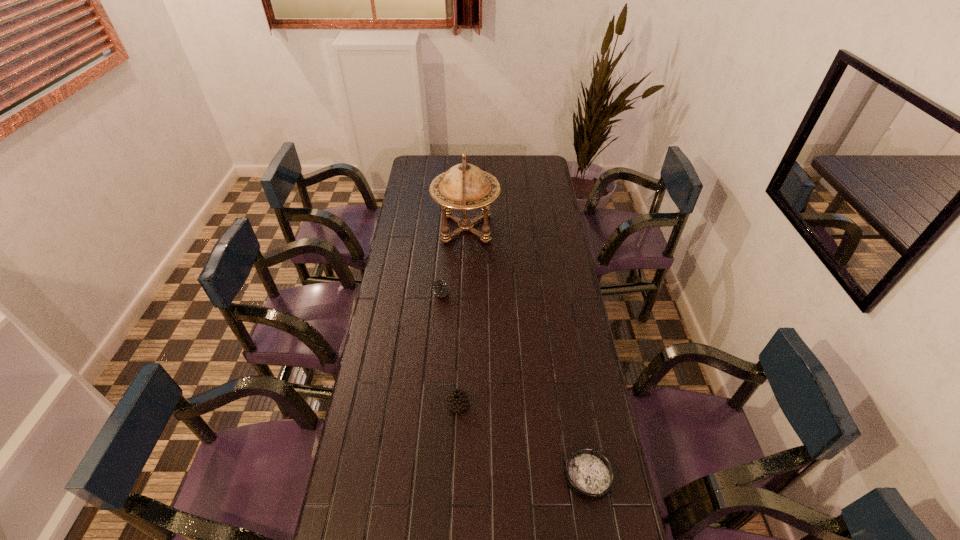
This screenshot has height=540, width=960. What are the coordinates of `free space that satisfies the following two spatial constraints: 1. on the front-facing side of the globe; 2. on the left side of the shortest object` in the screenshot? It's located at (457, 476).

Locate an element on the screen. vacant space that satisfies the following two spatial constraints: 1. on the back side of the nearest object; 2. at the narrow end of the nearer pinecone is located at coordinates (576, 404).

At what (x,y) coordinates should I click in order to perform the action: click on free space that satisfies the following two spatial constraints: 1. on the front-facing side of the tallest object; 2. on the left side of the ashtray. Please return your answer as a coordinate pair (x, y). Looking at the image, I should click on (457, 476).

Where is `blank space that satisfies the following two spatial constraints: 1. on the front-facing side of the globe; 2. on the front side of the farther pinecone`? The height and width of the screenshot is (540, 960). blank space that satisfies the following two spatial constraints: 1. on the front-facing side of the globe; 2. on the front side of the farther pinecone is located at coordinates (464, 294).